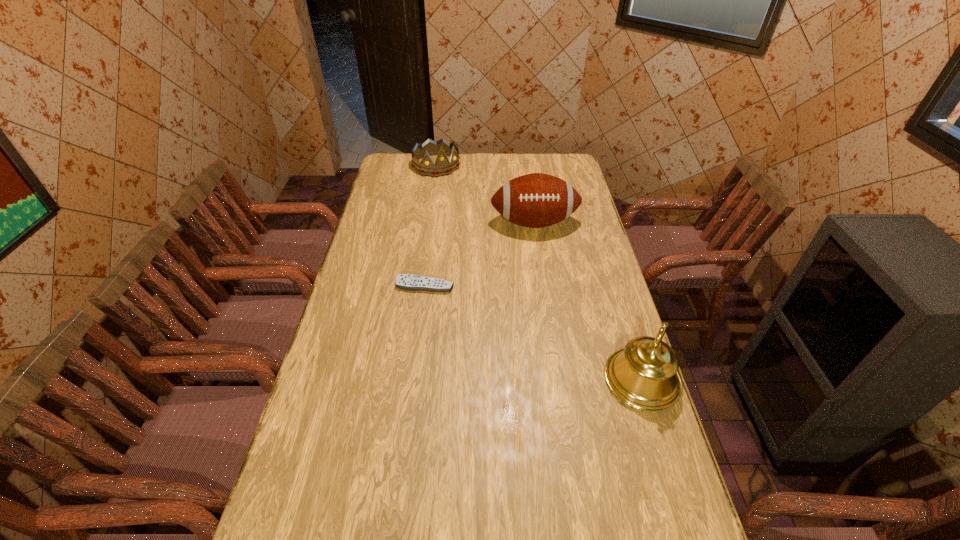
Find the location of a particular element. This screenshot has width=960, height=540. unoccupied area between the farthest object and the third farthest object is located at coordinates (430, 226).

This screenshot has width=960, height=540. I want to click on vacant point located between the shortest object and the football, so click(479, 254).

Find the location of `vacant space in between the second farthest object and the third tallest object`. vacant space in between the second farthest object and the third tallest object is located at coordinates (485, 194).

Locate an element on the screen. The height and width of the screenshot is (540, 960). empty space that is in between the shortest object and the farthest object is located at coordinates (430, 226).

Where is `unoccupied area between the football and the shortest object`? The image size is (960, 540). unoccupied area between the football and the shortest object is located at coordinates (479, 254).

Identify which object is the third nearest to the farthest object. Please provide its 2D coordinates. Your answer should be formatted as a tuple, i.e. [(x, y)], where the tuple contains the x and y coordinates of a point satisfying the conditions above.

[(644, 375)]

Locate which object ranks second in proximity to the third farthest object. Please provide its 2D coordinates. Your answer should be formatted as a tuple, i.e. [(x, y)], where the tuple contains the x and y coordinates of a point satisfying the conditions above.

[(644, 375)]

Locate an element on the screen. Image resolution: width=960 pixels, height=540 pixels. free space that satisfies the following two spatial constraints: 1. on the front side of the tiara; 2. on the left side of the football is located at coordinates 428,223.

Locate an element on the screen. The width and height of the screenshot is (960, 540). vacant region that satisfies the following two spatial constraints: 1. on the front side of the nearest object; 2. on the left side of the football is located at coordinates (558, 380).

At what (x,y) coordinates should I click in order to perform the action: click on vacant space that satisfies the following two spatial constraints: 1. on the front side of the third tallest object; 2. on the right side of the nearest object. Please return your answer as a coordinate pair (x, y). The image size is (960, 540). Looking at the image, I should click on (405, 380).